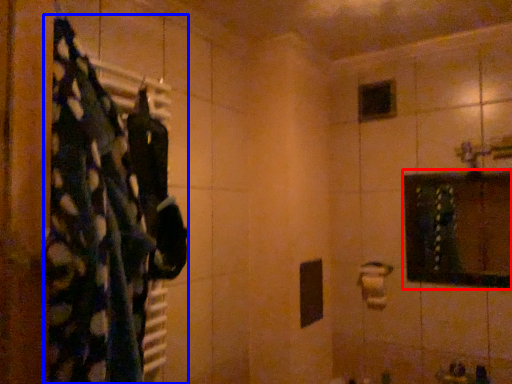
Question: Which object is closer to the camera taking this photo, medicine cabinet (highlighted by a red box) or laundry (highlighted by a blue box)?

Choices:
 (A) medicine cabinet
 (B) laundry

Answer: (B)